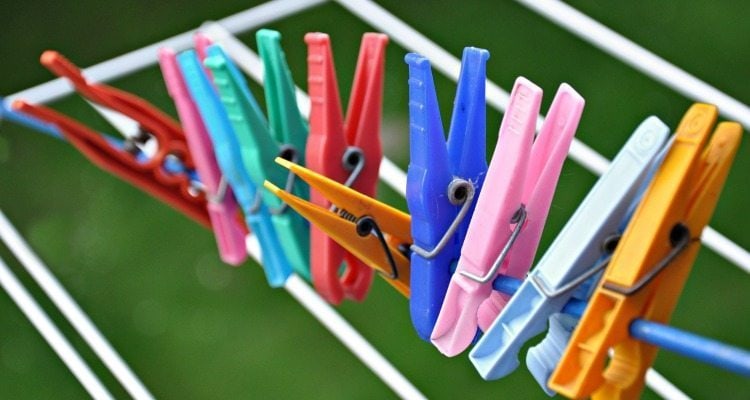
Locate an element on the screen. This screenshot has width=750, height=400. 2 white cords on upper right is located at coordinates (676, 71), (586, 157).